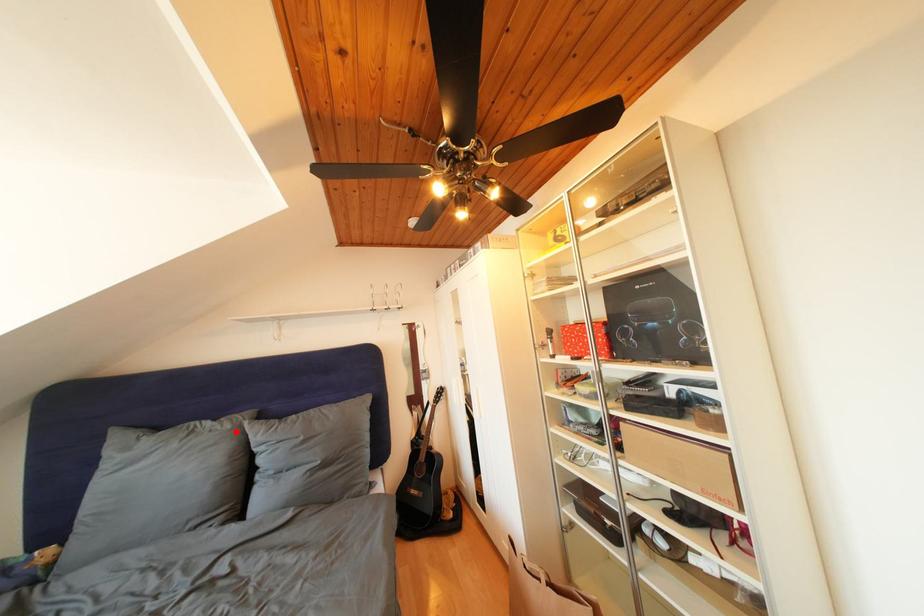
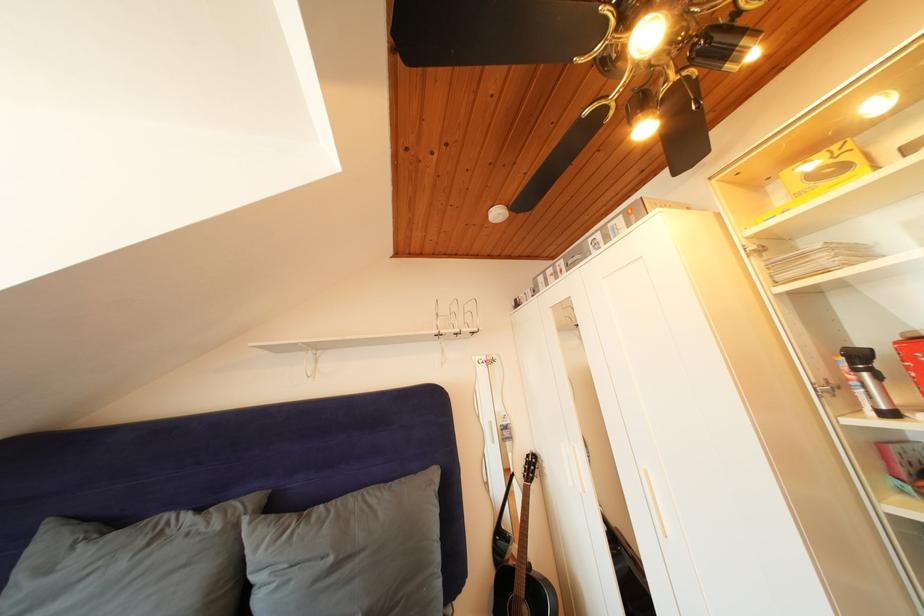
Question: I am providing you with two images of the same scene from different viewpoints. A red point is marked on the first image. Can you still see the location of the red point in image 2?

Choices:
 (A) Yes
 (B) No

Answer: (A)